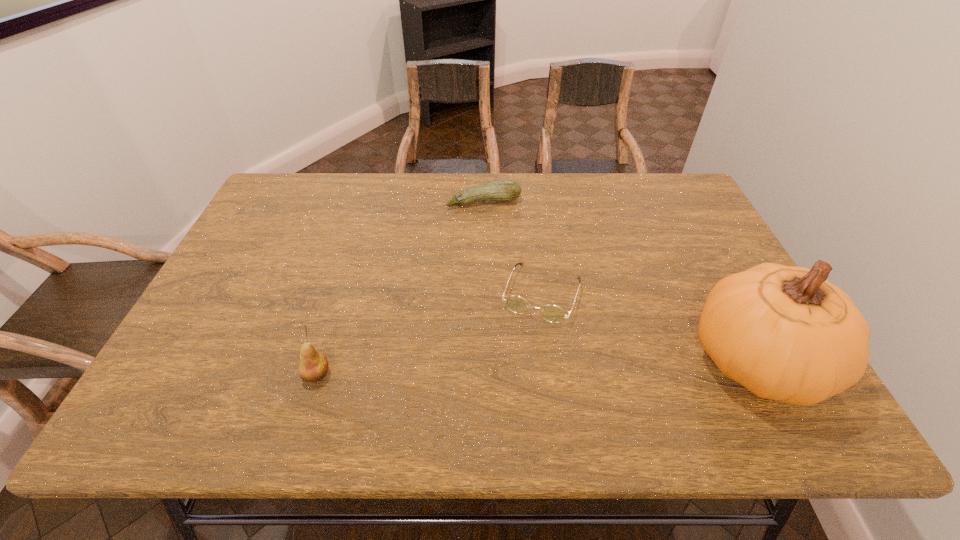
Locate an element on the screen. The height and width of the screenshot is (540, 960). free region at the right edge of the desktop is located at coordinates (720, 264).

I want to click on blank area at the far left corner, so click(x=285, y=206).

In the image, there is a desktop. Identify the location of vacant region at the far right corner. (650, 181).

At what (x,y) coordinates should I click in order to perform the action: click on blank region between the spectacles and the third shortest object. Please return your answer as a coordinate pair (x, y). Looking at the image, I should click on (429, 334).

The height and width of the screenshot is (540, 960). Find the location of `empty space that is in between the third shortest object and the rightmost object`. empty space that is in between the third shortest object and the rightmost object is located at coordinates (536, 368).

Identify the location of free spot between the zucchini and the tallest object. (619, 282).

This screenshot has width=960, height=540. I want to click on unoccupied position between the pear and the shortest object, so click(x=429, y=334).

At what (x,y) coordinates should I click in order to perform the action: click on unoccupied area between the farthest object and the spectacles. Please return your answer as a coordinate pair (x, y). Looking at the image, I should click on (513, 247).

Find the location of a particular element. unoccupied position between the zucchini and the pear is located at coordinates (400, 288).

Where is `free space between the zucchini and the rightmost object`? Image resolution: width=960 pixels, height=540 pixels. free space between the zucchini and the rightmost object is located at coordinates coord(619,282).